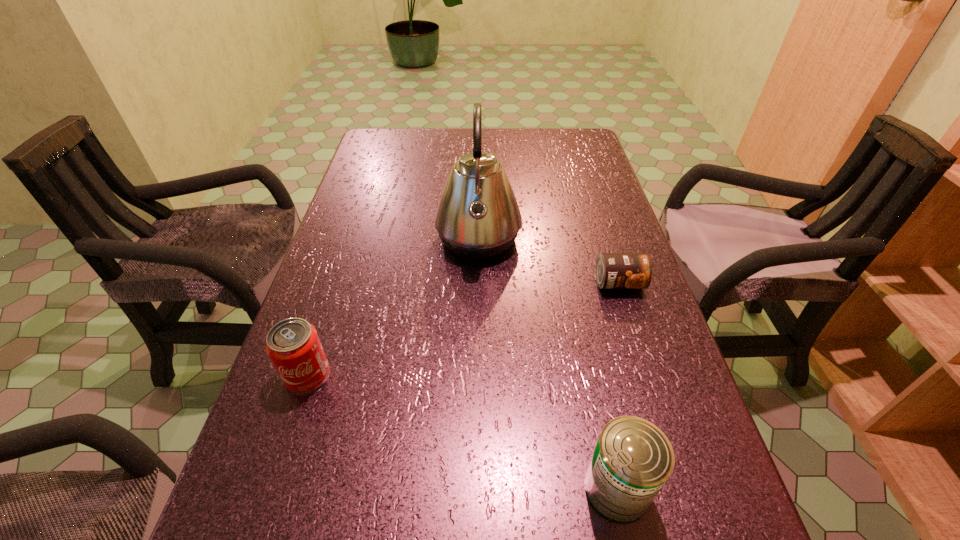
Locate which can ranks second in proximity to the leftmost object. Please provide its 2D coordinates. Your answer should be formatted as a tuple, i.e. [(x, y)], where the tuple contains the x and y coordinates of a point satisfying the conditions above.

[(613, 270)]

This screenshot has height=540, width=960. I want to click on free space in the image that satisfies the following two spatial constraints: 1. on the front side of the second farthest can; 2. on the left side of the third object from left to right, so click(271, 488).

Identify the location of vacant region that satisfies the following two spatial constraints: 1. from the spout of the second can from right to left; 2. on the right side of the kettle. (477, 488).

At what (x,y) coordinates should I click in order to perform the action: click on vacant region that satisfies the following two spatial constraints: 1. from the spout of the nearest object; 2. on the left side of the kettle. Please return your answer as a coordinate pair (x, y). Looking at the image, I should click on (477, 488).

In order to click on free spot that satisfies the following two spatial constraints: 1. from the spout of the third object from right to left; 2. on the left side of the nearest can in this screenshot , I will do `click(477, 488)`.

Image resolution: width=960 pixels, height=540 pixels. What are the coordinates of `vacant space that satisfies the following two spatial constraints: 1. from the spout of the third object from right to left; 2. on the back side of the second can from left to right` in the screenshot? It's located at (477, 488).

You are a GUI agent. You are given a task and a screenshot of the screen. Output one action in this format:
    pyautogui.click(x=<x>, y=<y>)
    Task: Click on the vacant area that satisfies the following two spatial constraints: 1. on the back side of the nearest can; 2. from the spout of the tallest object
    The image size is (960, 540).
    Given the screenshot: What is the action you would take?
    pyautogui.click(x=564, y=239)

The image size is (960, 540). I want to click on free space that satisfies the following two spatial constraints: 1. on the back side of the nearest can; 2. from the spout of the kettle, so click(564, 239).